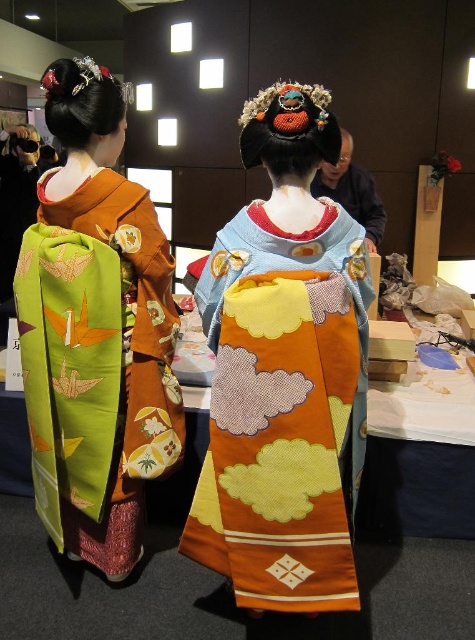
Which of these two, silky orange kimono at center or green silk kimono at left, stands shorter?

With less height is silky orange kimono at center.

Does silky orange kimono at center have a smaller size compared to green silk kimono at left?

Indeed, silky orange kimono at center has a smaller size compared to green silk kimono at left.

This screenshot has width=475, height=640. What do you see at coordinates (285, 372) in the screenshot?
I see `silky orange kimono at center` at bounding box center [285, 372].

Locate an element on the screen. silky orange kimono at center is located at coordinates (285, 372).